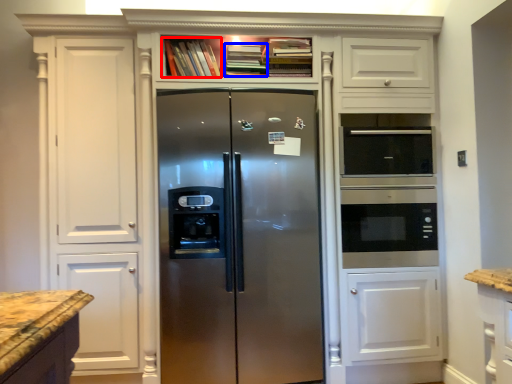
Question: Among these objects, which one is nearest to the camera, book (highlighted by a red box) or book (highlighted by a blue box)?

Choices:
 (A) book
 (B) book

Answer: (B)